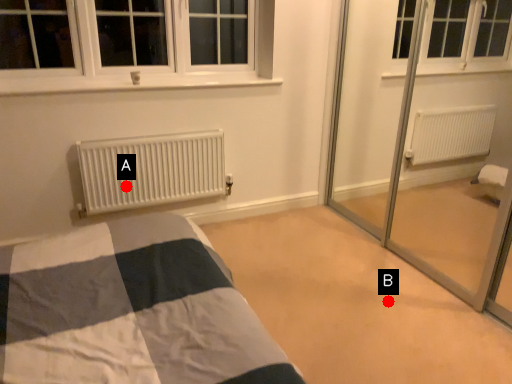
Question: Two points are circled on the image, labeled by A and B beside each circle. Among these points, which one is nearest to the camera?

Choices:
 (A) A is closer
 (B) B is closer

Answer: (B)